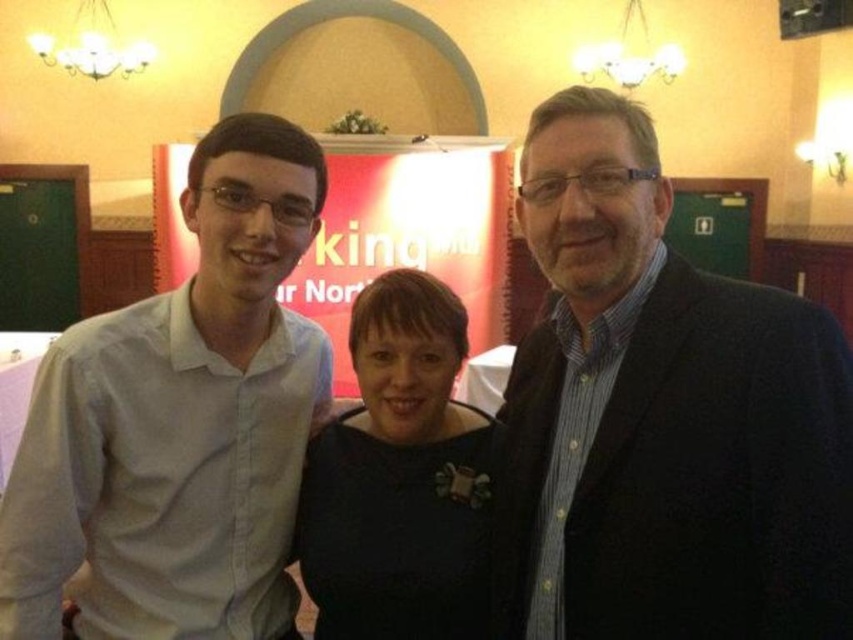
Can you confirm if dark blue suit at center is positioned to the right of black matte dress at center?

Indeed, dark blue suit at center is positioned on the right side of black matte dress at center.

Find the location of a particular element. The image size is (853, 640). dark blue suit at center is located at coordinates (664, 417).

This screenshot has width=853, height=640. Describe the element at coordinates (664, 417) in the screenshot. I see `dark blue suit at center` at that location.

I want to click on dark blue suit at center, so point(664,417).

Which is below, white shirt at center or black matte dress at center?

black matte dress at center is lower down.

Is white shirt at center below black matte dress at center?

No.

Is point (242, 253) farther from camera compared to point (424, 522)?

That is False.

Locate an element on the screen. white shirt at center is located at coordinates (178, 422).

Which of these two, dark blue suit at center or white shirt at center, stands taller?

white shirt at center is taller.

Between dark blue suit at center and white shirt at center, which one appears on the right side from the viewer's perspective?

Positioned to the right is dark blue suit at center.

Who is more distant from viewer, (x=672, y=486) or (x=196, y=573)?

The point (x=196, y=573) is behind.

Locate an element on the screen. dark blue suit at center is located at coordinates (664, 417).